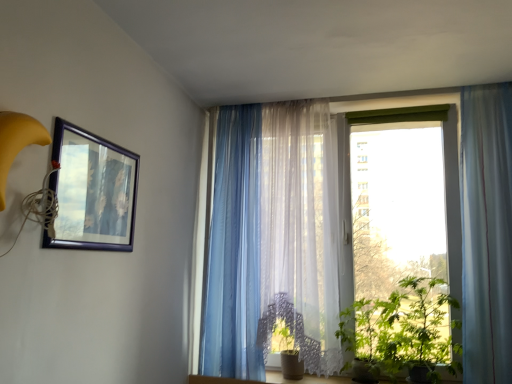
Question: Is translucent fabric at center thinner than translucent blue curtain at right, the third curtain when ordered from left to right?

Choices:
 (A) no
 (B) yes

Answer: (A)

Question: Considering the relative sizes of translucent fabric at center and translucent blue curtain at right, the 1th curtain in the right-to-left sequence, in the image provided, is translucent fabric at center taller than translucent blue curtain at right, the 1th curtain in the right-to-left sequence,?

Choices:
 (A) yes
 (B) no

Answer: (A)

Question: Is translucent fabric at center positioned far away from translucent blue curtain at right, the third curtain when ordered from left to right?

Choices:
 (A) yes
 (B) no

Answer: (B)

Question: Does translucent fabric at center come in front of translucent blue curtain at right, the third curtain when ordered from left to right?

Choices:
 (A) no
 (B) yes

Answer: (A)

Question: Considering the relative positions of translucent fabric at center and translucent blue curtain at right, the third curtain when ordered from left to right, in the image provided, is translucent fabric at center to the left of translucent blue curtain at right, the third curtain when ordered from left to right, from the viewer's perspective?

Choices:
 (A) yes
 (B) no

Answer: (A)

Question: From the image's perspective, is green leafy plant at lower right located above or below matte black picture frame at upper left?

Choices:
 (A) above
 (B) below

Answer: (B)

Question: Choose the correct answer: Is green leafy plant at lower right inside matte black picture frame at upper left or outside it?

Choices:
 (A) inside
 (B) outside

Answer: (B)

Question: Relative to matte black picture frame at upper left, is green leafy plant at lower right in front or behind?

Choices:
 (A) behind
 (B) front

Answer: (A)

Question: From a real-world perspective, is green leafy plant at lower right positioned above or below matte black picture frame at upper left?

Choices:
 (A) below
 (B) above

Answer: (A)

Question: Is translucent fabric curtain at center, the second curtain viewed from the right, bigger or smaller than translucent blue curtain at center, arranged as the third curtain when viewed from the right?

Choices:
 (A) small
 (B) big

Answer: (B)

Question: In terms of width, does translucent fabric curtain at center, the second curtain when ordered from left to right, look wider or thinner when compared to translucent blue curtain at center, arranged as the third curtain when viewed from the right?

Choices:
 (A) thin
 (B) wide

Answer: (B)

Question: Is point (214, 321) positioned closer to the camera than point (218, 198)?

Choices:
 (A) closer
 (B) farther

Answer: (A)

Question: From a real-world perspective, is translucent fabric curtain at center, the second curtain viewed from the right, positioned above or below translucent blue curtain at center, which is counted as the 1th curtain, starting from the left?

Choices:
 (A) below
 (B) above

Answer: (B)

Question: From the image's perspective, is green leafy plant at lower right positioned above or below translucent blue curtain at center, arranged as the third curtain when viewed from the right?

Choices:
 (A) above
 (B) below

Answer: (B)

Question: In the image, is green leafy plant at lower right positioned in front of or behind translucent blue curtain at center, arranged as the third curtain when viewed from the right?

Choices:
 (A) behind
 (B) front

Answer: (B)